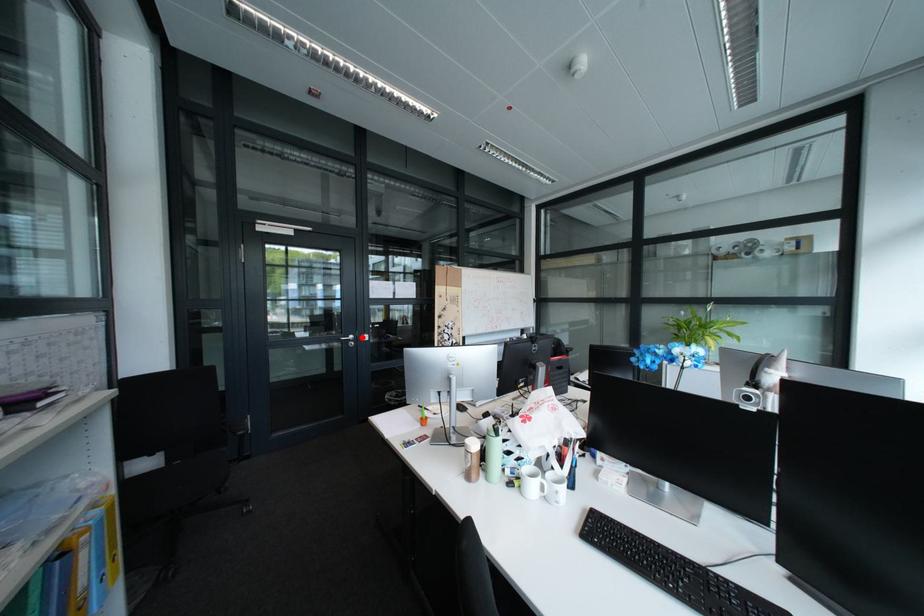
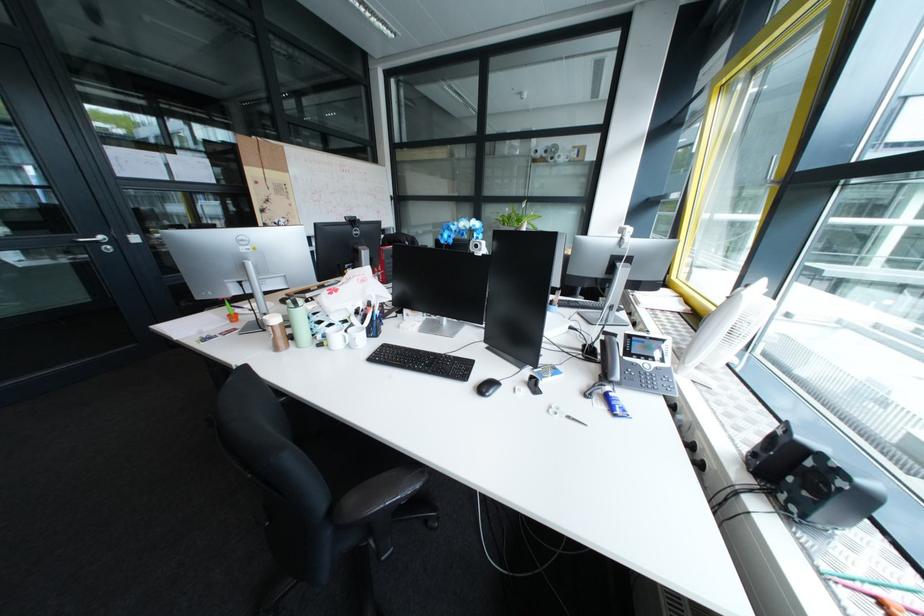
Question: I am providing you with two images of the same scene from different viewpoints. Given a red point in image1, look at the same physical point in image2. Is it:

Choices:
 (A) Closer to the viewpoint
 (B) Farther from the viewpoint

Answer: (B)